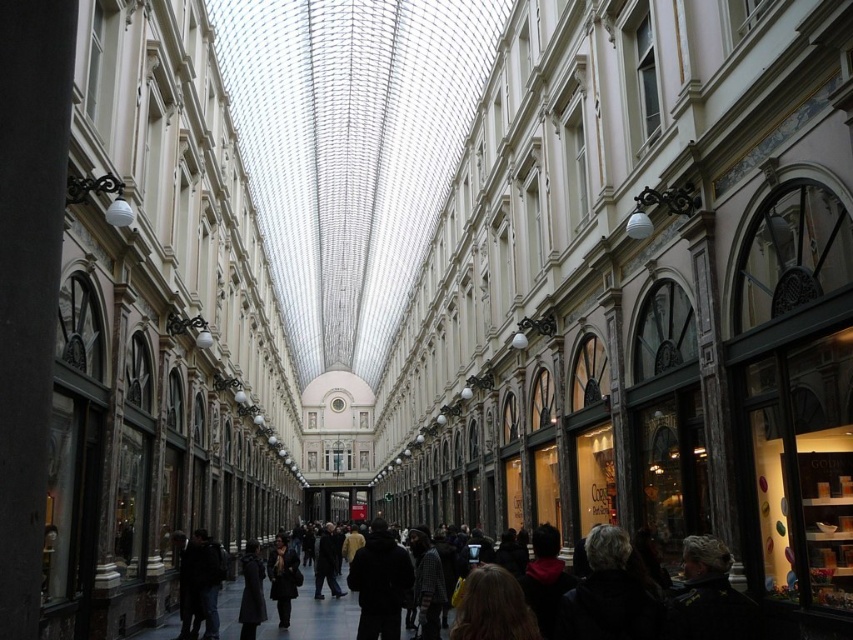
You are a customer in the arcade and want to hang your dark woolen coat at center and dark gray wool coat at center on a coat rack. The coat rack has two hooks at different heights. The lower hook can accommodate coats up to 1 meter tall, while the upper hook is for coats taller than 1 meter. Which coat should go on the upper hook?

The dark gray wool coat at center should go on the upper hook because it has a greater height than the dark woolen coat at center, which means it exceeds the 1 meter limit for the lower hook.

You are a customer in the arcade and want to try on both the dark woolen coat at center and the dark gray wool coat at center. Given that the fitting rooms are located at the far end of the arcade, which coat should you pick up first to minimize walking distance?

The dark woolen coat at center is 30.59 meters from dark gray wool coat at center. To minimize walking distance, you should pick up the dark gray wool coat at center first, then proceed to the dark woolen coat at center since they are spaced apart.